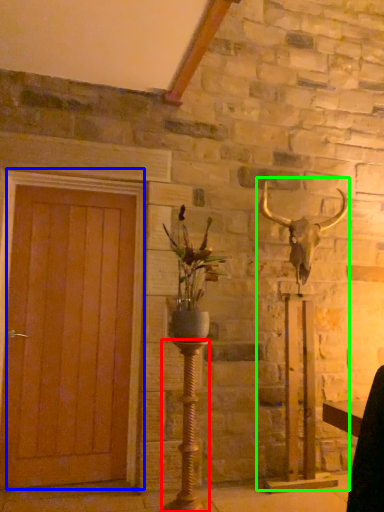
Question: Which is nearer to the candle holder (highlighted by a red box)? door (highlighted by a blue box) or sculpture (highlighted by a green box).

Choices:
 (A) door
 (B) sculpture

Answer: (A)